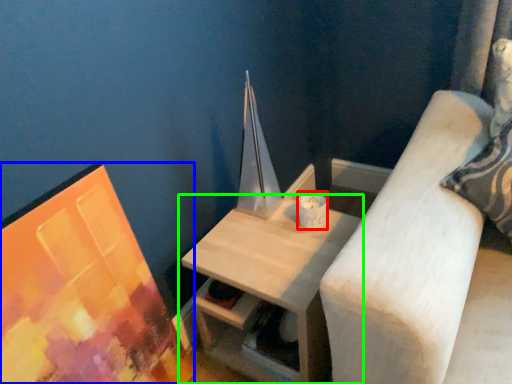
Question: Which is nearer to the candle holder (highlighted by a red box)? picture frame (highlighted by a blue box) or table (highlighted by a green box).

Choices:
 (A) picture frame
 (B) table

Answer: (B)